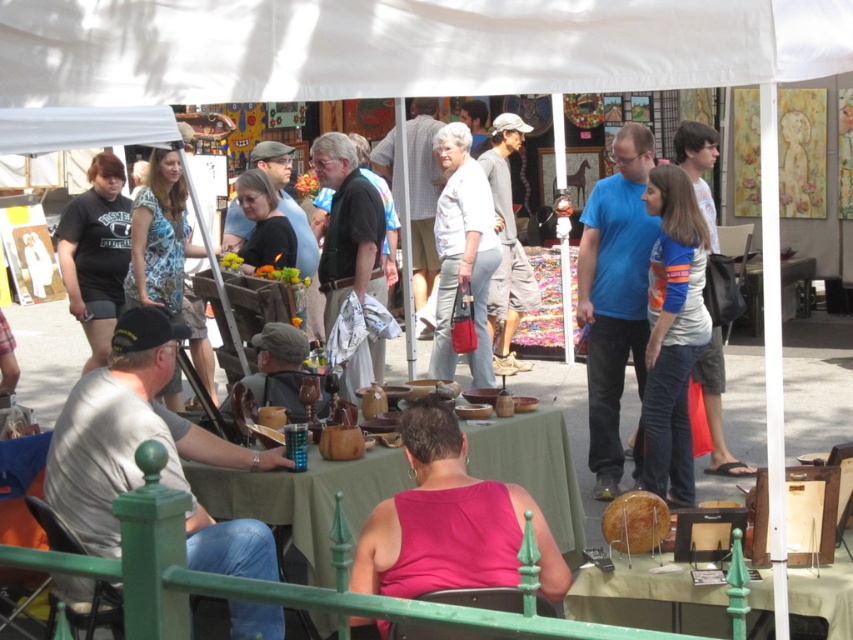
Question: Which point appears closest to the camera in this image?

Choices:
 (A) (596, 390)
 (B) (442, 308)
 (C) (701, 259)
 (D) (717, 369)

Answer: (C)

Question: Among these points, which one is farthest from the camera?

Choices:
 (A) (495, 195)
 (B) (635, 294)
 (C) (691, 460)

Answer: (A)

Question: Is gray cotton shirt at center thinner than blue/white striped shirt at upper right?

Choices:
 (A) no
 (B) yes

Answer: (A)

Question: Can you confirm if green fabric table at center is smaller than blue/white striped shirt at upper right?

Choices:
 (A) yes
 (B) no

Answer: (A)

Question: Considering the relative positions of wooden sphere at center and gray cotton shirt at center in the image provided, where is wooden sphere at center located with respect to gray cotton shirt at center?

Choices:
 (A) right
 (B) left

Answer: (A)

Question: Which point is closer to the camera?

Choices:
 (A) blue jersey at center
 (B) green fabric table at center
 (C) black cotton t-shirt at left

Answer: (B)